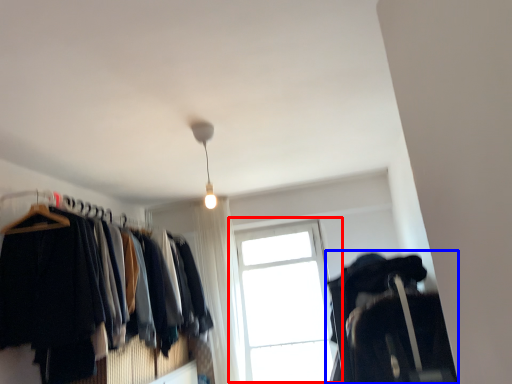
Question: Which point is closer to the camera, window (highlighted by a red box) or closet (highlighted by a blue box)?

Choices:
 (A) window
 (B) closet

Answer: (B)